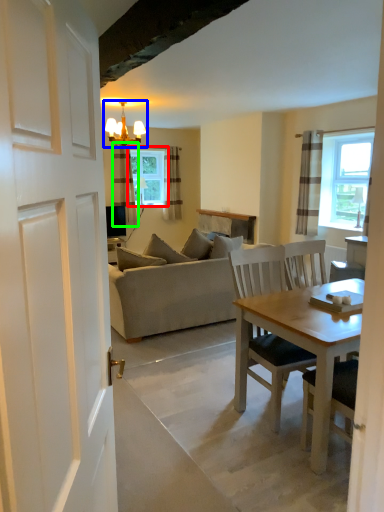
Question: Considering the real-world distances, which object is farthest from window (highlighted by a red box)? light fixture (highlighted by a blue box) or curtain (highlighted by a green box)?

Choices:
 (A) light fixture
 (B) curtain

Answer: (A)